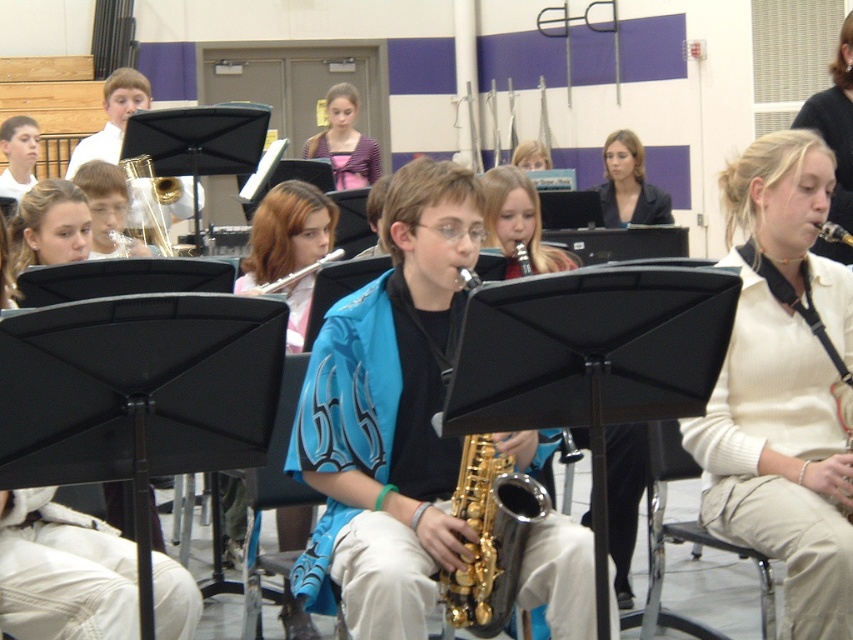
Question: Considering the real-world distances, which object is farthest from the gold metallic saxophone at center?

Choices:
 (A) white sweater at center
 (B) matte black jacket at upper center
 (C) purple satin dress at center

Answer: (C)

Question: Does blonde hair at upper right appear over matte silver flute at center?

Choices:
 (A) yes
 (B) no

Answer: (A)

Question: Does white sweater at center appear over gold shiny saxophone at center?

Choices:
 (A) no
 (B) yes

Answer: (B)

Question: Which object is closer to the camera taking this photo?

Choices:
 (A) smooth pink sweater at center
 (B) white sweater at center

Answer: (B)

Question: Which object appears farthest from the camera in this image?

Choices:
 (A) gold brass saxophone at center
 (B) matte silver flute at center

Answer: (A)

Question: Observing the image, what is the correct spatial positioning of matte silver flute at center in reference to gold metallic saxophone at center?

Choices:
 (A) below
 (B) above

Answer: (A)